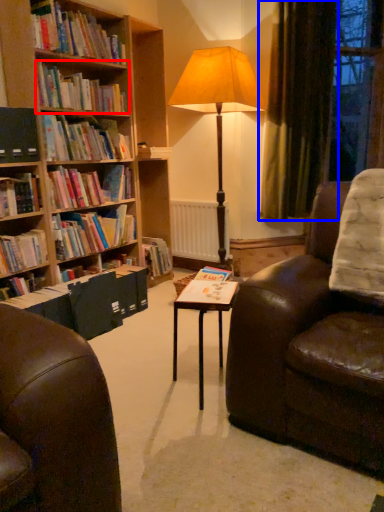
Question: Which object appears farthest to the camera in this image, book (highlighted by a red box) or curtain (highlighted by a blue box)?

Choices:
 (A) book
 (B) curtain

Answer: (B)